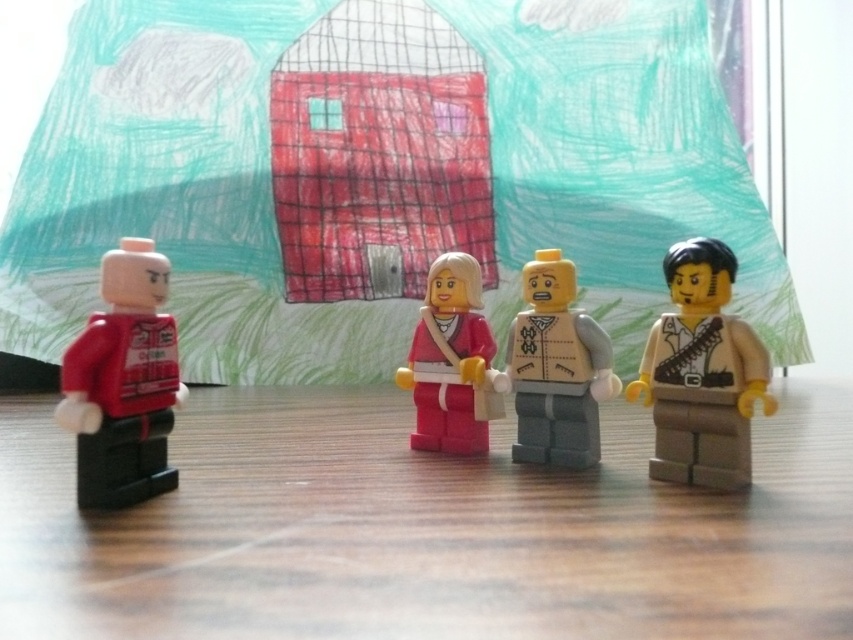
Question: Does tan matte minifigure at right have a greater width compared to pink matte figure at center?

Choices:
 (A) yes
 (B) no

Answer: (B)

Question: Can you confirm if wooden table at center is positioned to the left of tan matte minifigure at right?

Choices:
 (A) no
 (B) yes

Answer: (B)

Question: Which point is closer to the camera?

Choices:
 (A) (671, 568)
 (B) (469, 336)
 (C) (136, 392)
 (D) (567, 374)

Answer: (A)

Question: Can you confirm if wooden table at center is positioned to the left of matte red shirt at left?

Choices:
 (A) no
 (B) yes

Answer: (A)

Question: Among these objects, which one is nearest to the camera?

Choices:
 (A) tan matte minifigure at right
 (B) wooden table at center
 (C) matte red shirt at left
 (D) light gray plastic figure at center

Answer: (B)

Question: Which object is positioned farthest from the pink matte figure at center?

Choices:
 (A) tan matte minifigure at right
 (B) light gray plastic figure at center
 (C) matte red shirt at left

Answer: (C)